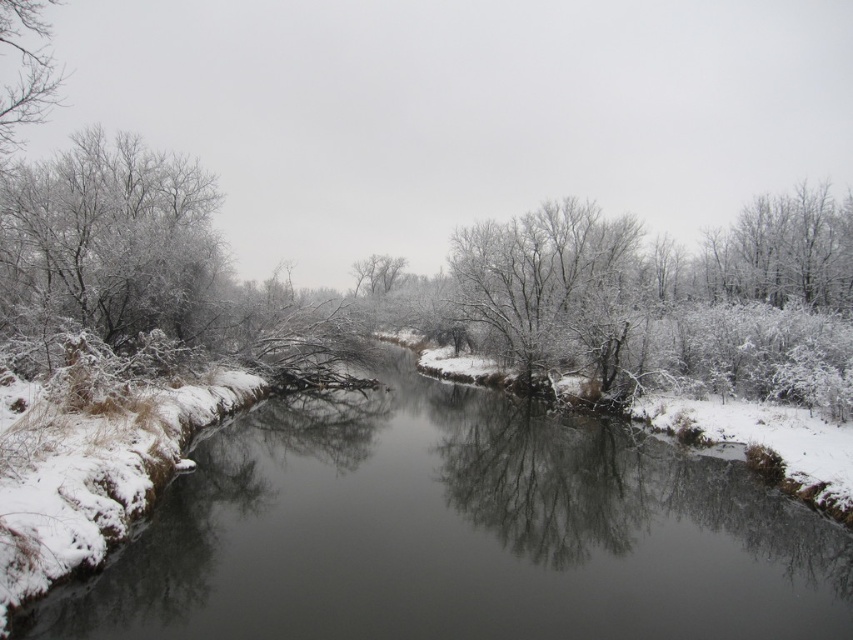
Is white frosty tree at upper left positioned before white frosty tree at center?

Yes, white frosty tree at upper left is closer to the viewer.

This screenshot has height=640, width=853. Describe the element at coordinates (24, 67) in the screenshot. I see `white frosty tree at upper left` at that location.

Does point (24, 77) come behind point (383, 256)?

Yes.

The image size is (853, 640). I want to click on white frosty tree at upper left, so click(x=24, y=67).

Can you confirm if frosted white tree at left is positioned to the left of white frosty tree at center?

Yes, frosted white tree at left is to the left of white frosty tree at center.

Identify the location of frosted white tree at left. The height and width of the screenshot is (640, 853). (112, 240).

Which is in front, point (91, 129) or point (374, 259)?

Positioned in front is point (91, 129).

This screenshot has height=640, width=853. In order to click on frosted white tree at left in this screenshot , I will do `click(112, 240)`.

Consider the image. Between frosted white tree at left and white frosty tree at upper left, which one appears on the left side from the viewer's perspective?

white frosty tree at upper left is more to the left.

Describe the element at coordinates (112, 240) in the screenshot. I see `frosted white tree at left` at that location.

Between point (136, 248) and point (25, 76), which one is positioned in front?

Point (136, 248) is in front.

Identify the location of frosted white tree at left. The height and width of the screenshot is (640, 853). (112, 240).